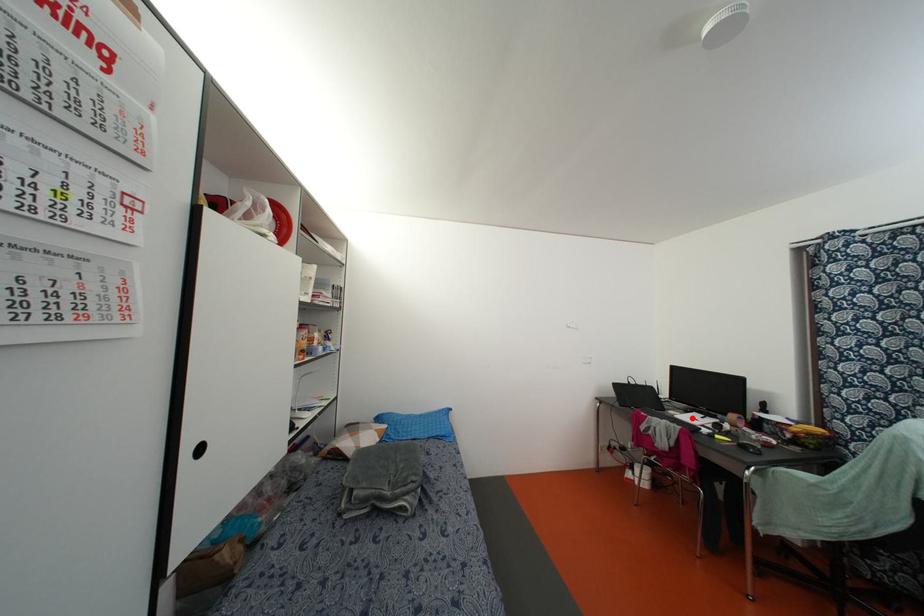
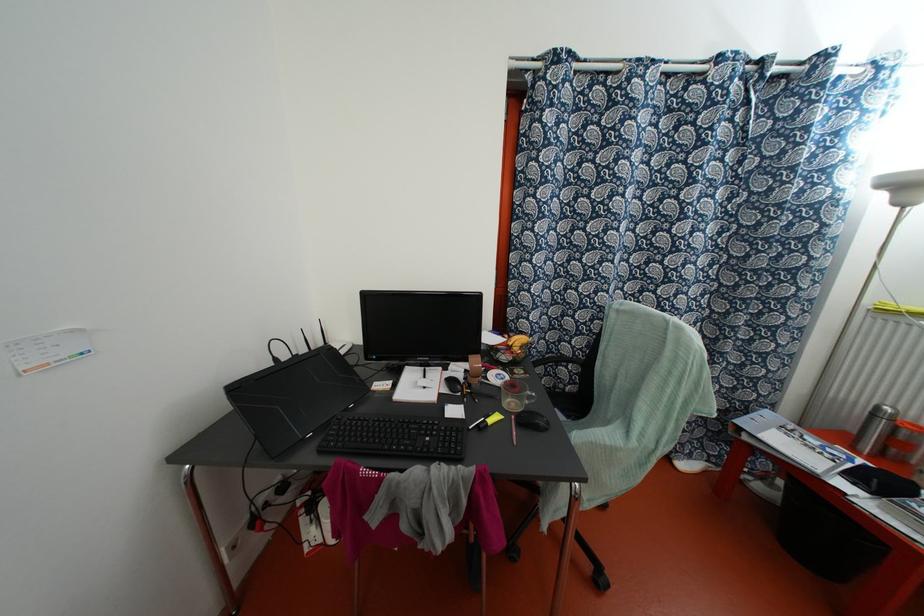
In the second image, find the point that corresponds to the highlighted location in the first image.

(418, 386)